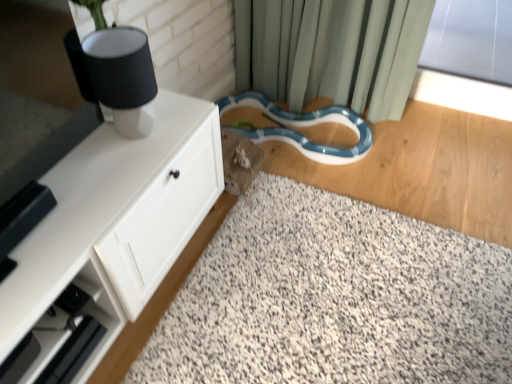
Locate an element on the screen. vacant area located to the right-hand side of black matte table lamp at upper left is located at coordinates (179, 126).